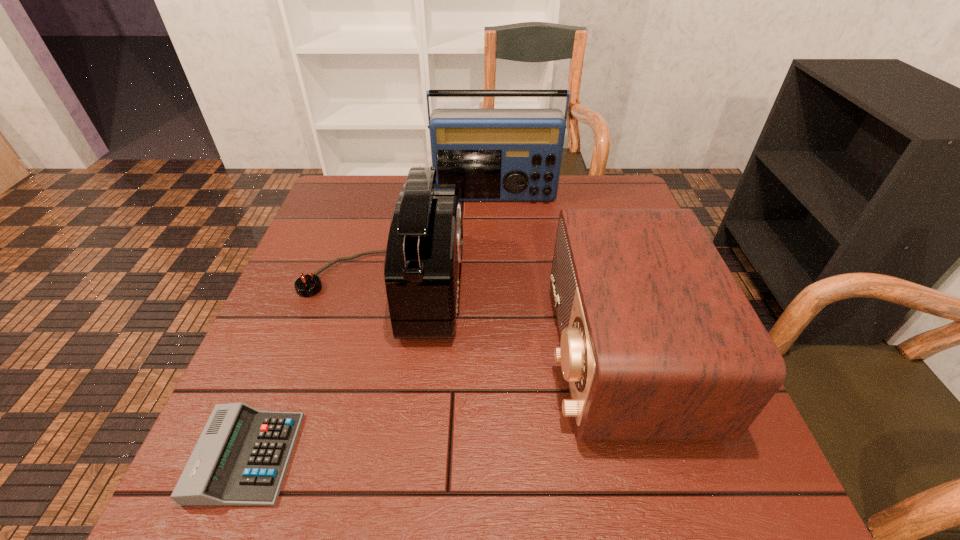
I want to click on object that is at the far edge, so [x=491, y=154].

Where is `object that is at the near edge`? The image size is (960, 540). object that is at the near edge is located at coordinates (241, 457).

Identify the location of radio receiver that is at the left edge. (424, 250).

Find the location of `calculator located at the left edge`. calculator located at the left edge is located at coordinates (241, 457).

This screenshot has height=540, width=960. I want to click on object that is positioned at the right edge, so (658, 342).

This screenshot has height=540, width=960. Identify the location of object present at the near left corner. (241, 457).

In order to click on blank space at the far edge of the desktop in this screenshot , I will do `click(389, 180)`.

The width and height of the screenshot is (960, 540). What are the coordinates of `free space at the near edge of the desktop` in the screenshot? It's located at (339, 459).

Locate an element on the screen. This screenshot has width=960, height=540. free spot at the left edge of the desktop is located at coordinates coord(308,445).

At what (x,y) coordinates should I click in order to perform the action: click on vacant area at the right edge of the desktop. Please return your answer as a coordinate pair (x, y). This screenshot has height=540, width=960. Looking at the image, I should click on (741, 446).